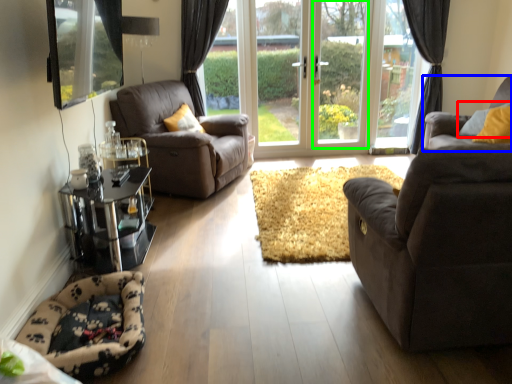
Question: Which object is positioned farthest from pillow (highlighted by a red box)? Select from studio couch (highlighted by a blue box) and window frame (highlighted by a green box).

Choices:
 (A) studio couch
 (B) window frame

Answer: (B)